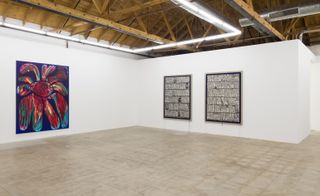
At what (x,y) coordinates should I click in order to perform the action: click on brown wooden ceilings. Please return your answer as a coordinate pair (x, y). This screenshot has height=196, width=320. Looking at the image, I should click on (69, 17), (117, 30), (146, 17), (264, 24).